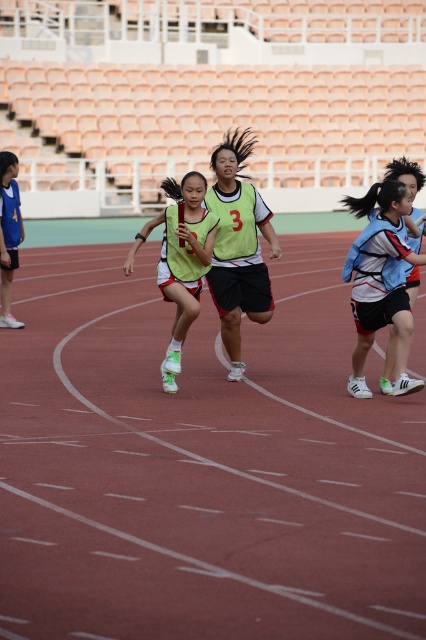
Describe the element at coordinates (380, 280) in the screenshot. I see `light blue jersey at center` at that location.

Can you confirm if light blue jersey at center is smaller than green matte jersey at center?

Yes.

Describe the element at coordinates (380, 280) in the screenshot. I see `light blue jersey at center` at that location.

Identify the location of light blue jersey at center. This screenshot has width=426, height=640. (380, 280).

Is red rubber track at center positioned at the back of light blue jersey at center?

No, red rubber track at center is in front of light blue jersey at center.

Is red rubber track at center wider than light blue jersey at center?

Indeed, red rubber track at center has a greater width compared to light blue jersey at center.

The height and width of the screenshot is (640, 426). I want to click on red rubber track at center, so click(201, 467).

Does red rubber track at center have a greater height compared to green matte jersey at center?

No, red rubber track at center is not taller than green matte jersey at center.

Does red rubber track at center come behind green matte jersey at center?

No, red rubber track at center is in front of green matte jersey at center.

The image size is (426, 640). What do you see at coordinates (201, 467) in the screenshot? I see `red rubber track at center` at bounding box center [201, 467].

Image resolution: width=426 pixels, height=640 pixels. Find the location of `red rubber track at center`. red rubber track at center is located at coordinates (201, 467).